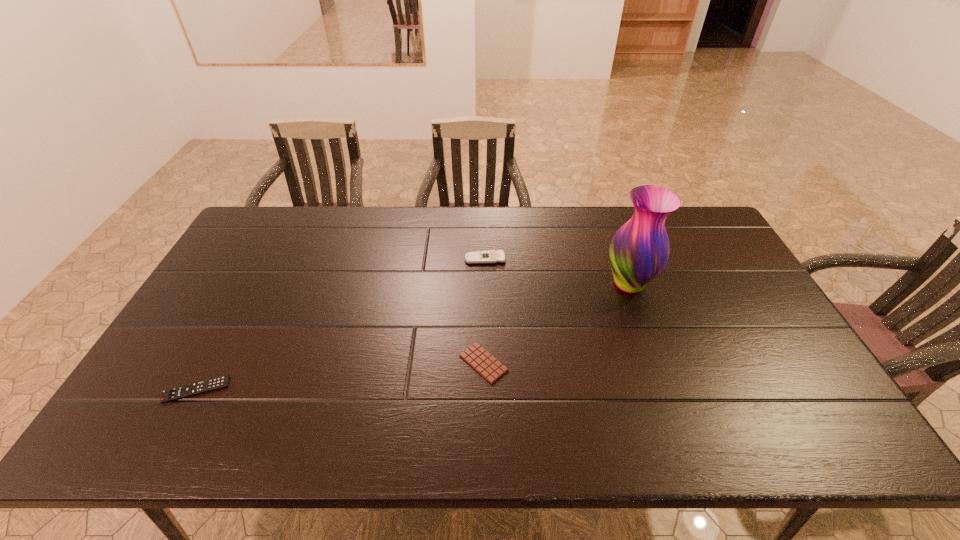
Identify the location of free space between the rightmost object and the candy bar. The image size is (960, 540). click(x=556, y=323).

Where is `vacant point located between the right remote control and the candy bar`? vacant point located between the right remote control and the candy bar is located at coordinates (484, 311).

Where is `unoccupied position between the farthest object and the third nearest object`? This screenshot has height=540, width=960. unoccupied position between the farthest object and the third nearest object is located at coordinates (557, 272).

This screenshot has width=960, height=540. What are the coordinates of `free space between the candy bar and the vase` in the screenshot? It's located at (x=556, y=323).

Where is `free point between the vase and the shortest object`? This screenshot has width=960, height=540. free point between the vase and the shortest object is located at coordinates (556, 323).

What are the coordinates of `unoccupied position between the shorter remote control and the tallest object` in the screenshot? It's located at (413, 337).

In order to click on free space between the farther remote control and the candy bar in this screenshot , I will do `click(484, 311)`.

You are a GUI agent. You are given a task and a screenshot of the screen. Output one action in this format:
    pyautogui.click(x=<x>, y=<y>)
    Task: Click on the third closest object relative to the tallest object
    
    Given the screenshot: What is the action you would take?
    pyautogui.click(x=184, y=391)

The image size is (960, 540). In order to click on object that is the nearest to the tallest object in this screenshot , I will do `click(490, 256)`.

Identify the location of vacant space that satisfies the following two spatial constraints: 1. on the back side of the candy bar; 2. on the left side of the farther remote control. (483, 259).